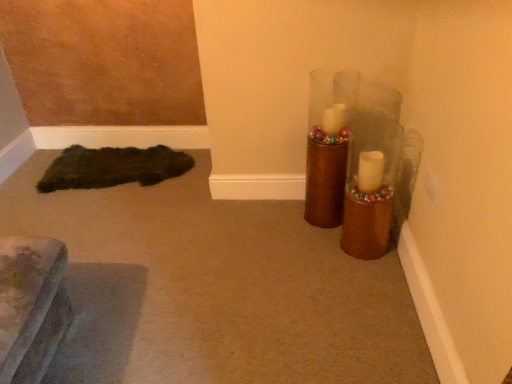
Question: From a real-world perspective, is dark fuzzy rug at lower left above or below shiny brown vase at upper right?

Choices:
 (A) above
 (B) below

Answer: (B)

Question: Would you say dark fuzzy rug at lower left is inside or outside shiny brown vase at upper right?

Choices:
 (A) inside
 (B) outside

Answer: (B)

Question: From the image's perspective, is dark fuzzy rug at lower left located above or below shiny brown vase at upper right?

Choices:
 (A) below
 (B) above

Answer: (A)

Question: Is point (312, 142) positioned closer to the camera than point (104, 148)?

Choices:
 (A) farther
 (B) closer

Answer: (B)

Question: From a real-world perspective, relative to dark fuzzy rug at lower left, is shiny brown vase at upper right vertically above or below?

Choices:
 (A) above
 (B) below

Answer: (A)

Question: Would you say shiny brown vase at upper right is inside or outside dark fuzzy rug at lower left?

Choices:
 (A) inside
 (B) outside

Answer: (B)

Question: Based on their positions, is shiny brown vase at upper right located to the left or right of dark fuzzy rug at lower left?

Choices:
 (A) left
 (B) right

Answer: (B)